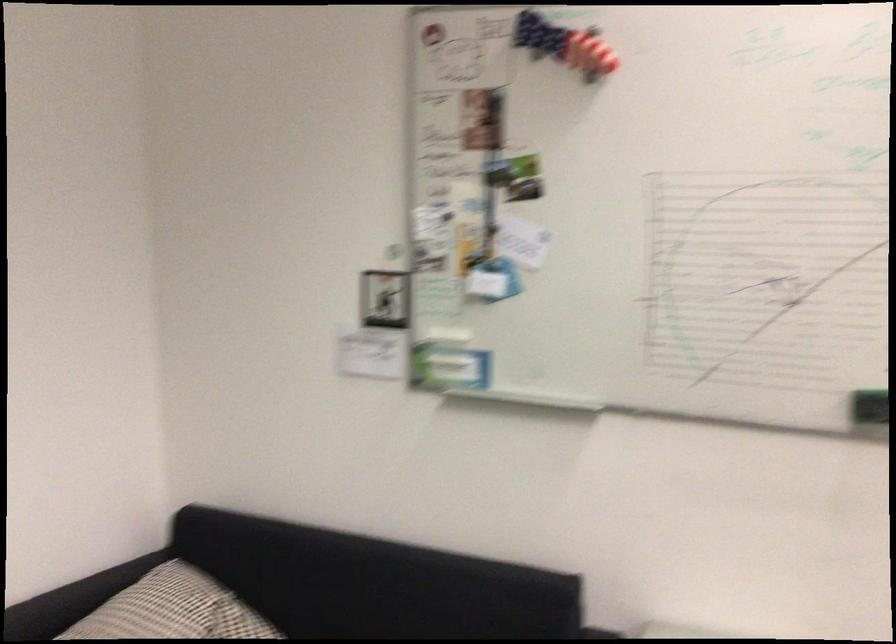
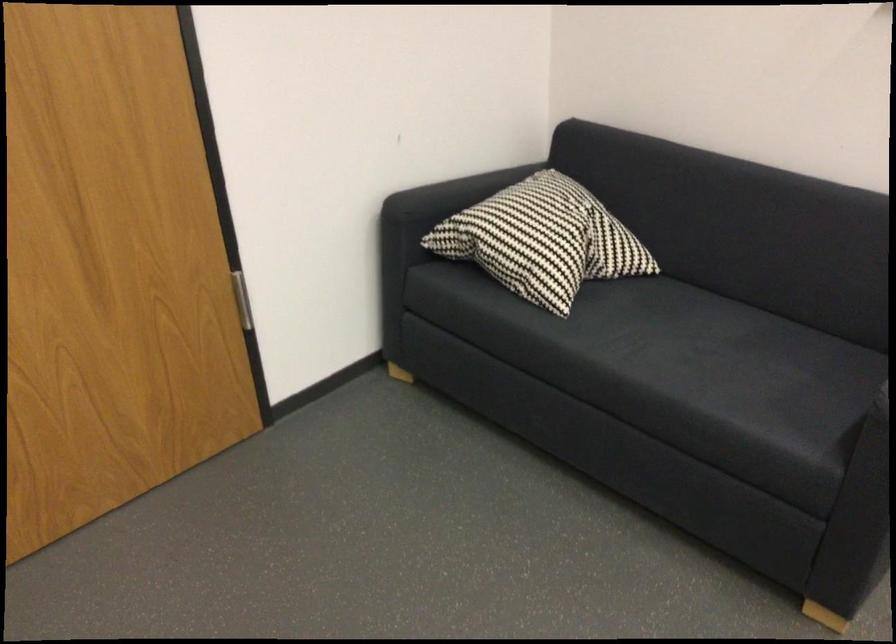
How did the camera likely rotate?

The camera rotated toward left-down.